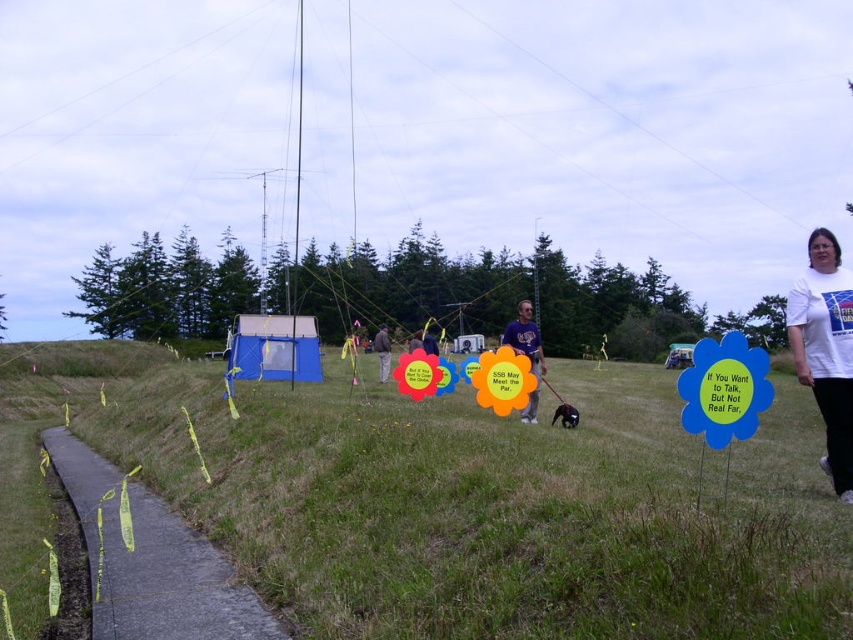
Question: Among these objects, which one is farthest from the camera?

Choices:
 (A) dark blue shirt at center
 (B) green grassy at lower left
 (C) gray concrete path at lower left

Answer: (A)

Question: Is white t-shirt at right closer to camera compared to black fur dog at center?

Choices:
 (A) no
 (B) yes

Answer: (B)

Question: Can you confirm if white t-shirt at right is wider than dark blue shirt at center?

Choices:
 (A) yes
 (B) no

Answer: (A)

Question: Is green grassy at lower left below matte purple shirt at center?

Choices:
 (A) no
 (B) yes

Answer: (B)

Question: Which object is the farthest from the black fur dog at center?

Choices:
 (A) white t-shirt at right
 (B) green grassy at lower left

Answer: (B)

Question: Which object appears closest to the camera in this image?

Choices:
 (A) black fur dog at center
 (B) white t-shirt at right

Answer: (B)